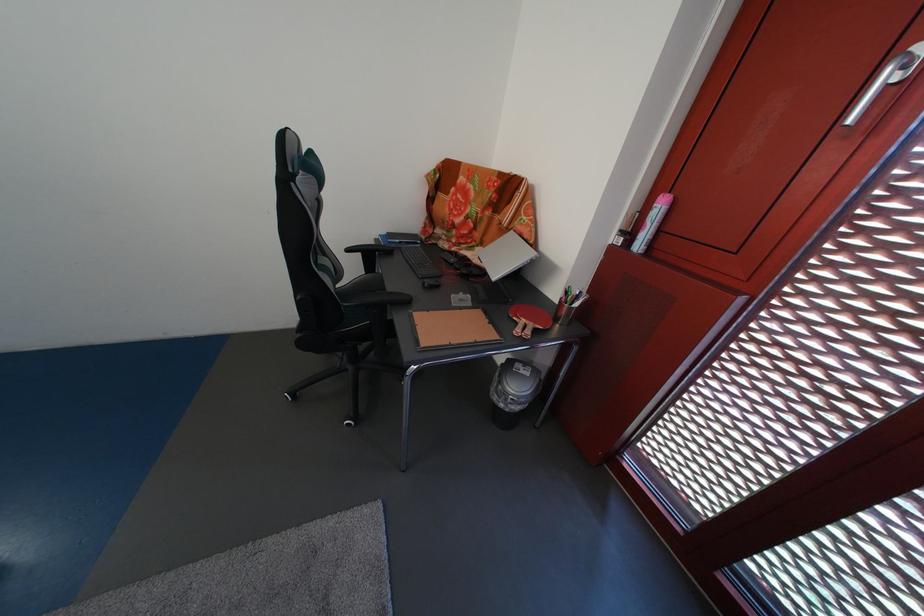
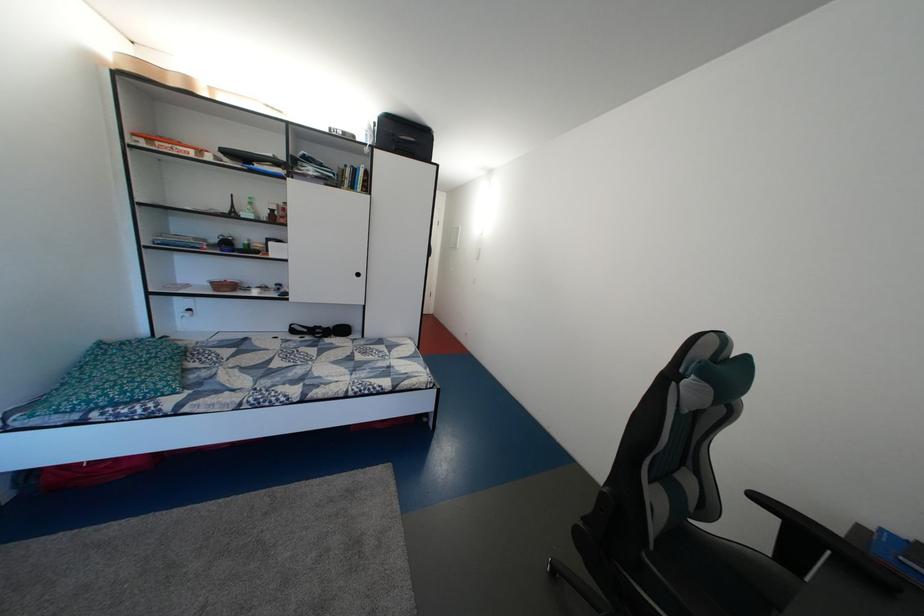
Question: The first image is from the beginning of the video and the second image is from the end. How did the camera likely rotate when shooting the video?

Choices:
 (A) Left
 (B) Right
 (C) Up
 (D) Down

Answer: (A)